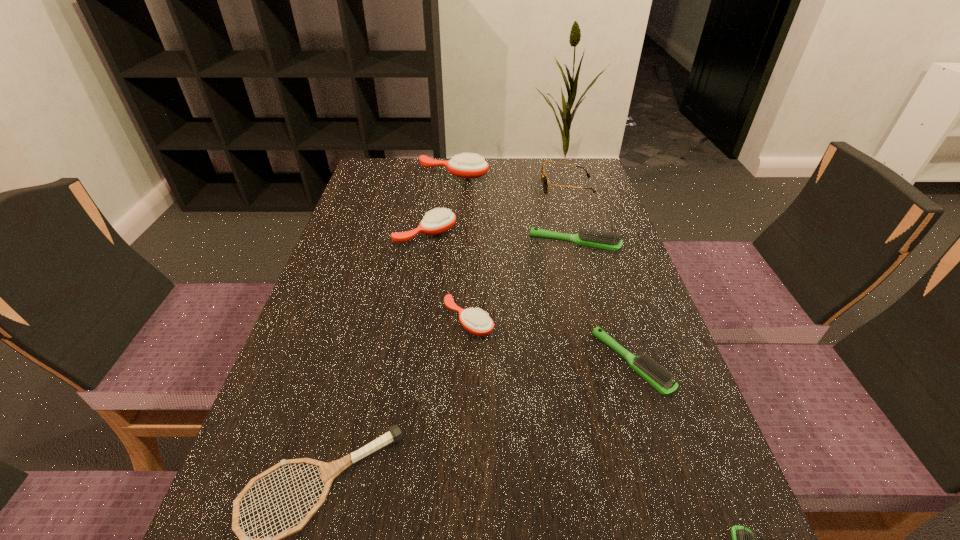
Find the location of a particular element. This screenshot has width=960, height=540. the biggest orange hairbrush is located at coordinates (469, 165).

This screenshot has height=540, width=960. Identify the location of the farthest hairbrush. (469, 165).

Where is `sunglasses`? sunglasses is located at coordinates (543, 177).

Locate an element on the screen. The height and width of the screenshot is (540, 960). the second tallest hairbrush is located at coordinates (440, 220).

The width and height of the screenshot is (960, 540). In order to click on the second nearest orange hairbrush in this screenshot , I will do `click(440, 220)`.

At what (x,y) coordinates should I click in order to perform the action: click on the biggest light hairbrush. Please return your answer as a coordinate pair (x, y). This screenshot has height=540, width=960. Looking at the image, I should click on (599, 240).

Locate an element on the screen. This screenshot has width=960, height=540. the smallest orange hairbrush is located at coordinates (475, 321).

The height and width of the screenshot is (540, 960). Identify the location of the second farthest light hairbrush. (652, 372).

The image size is (960, 540). In order to click on the fifth tallest hairbrush in this screenshot , I will do `click(652, 372)`.

The image size is (960, 540). I want to click on free spot located 0.240m on the right of the farthest hairbrush, so click(x=565, y=174).